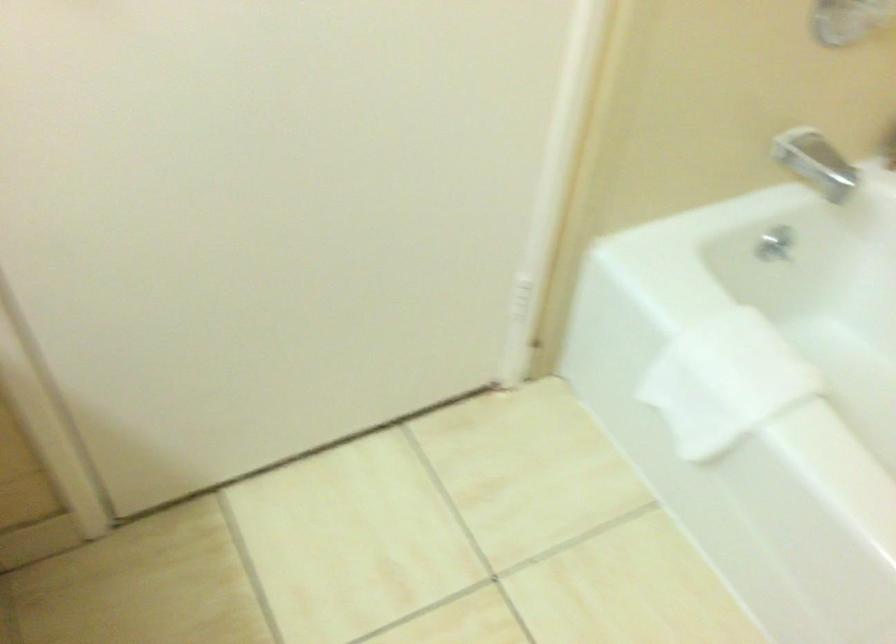
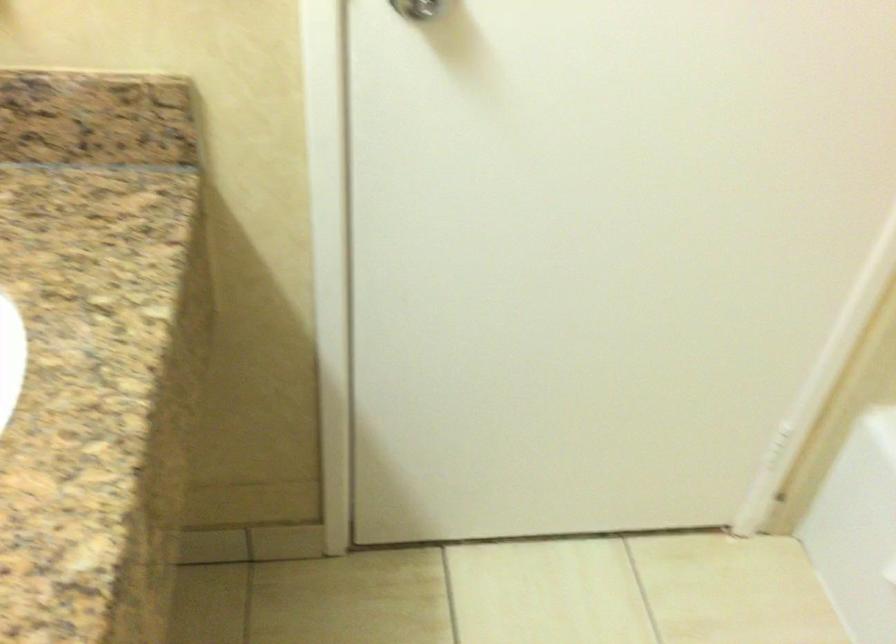
Question: The camera is either moving clockwise (left) or counter-clockwise (right) around the object. The first image is from the beginning of the video and the second image is from the end. Is the camera moving left or right when shooting the video?

Choices:
 (A) Left
 (B) Right

Answer: (B)